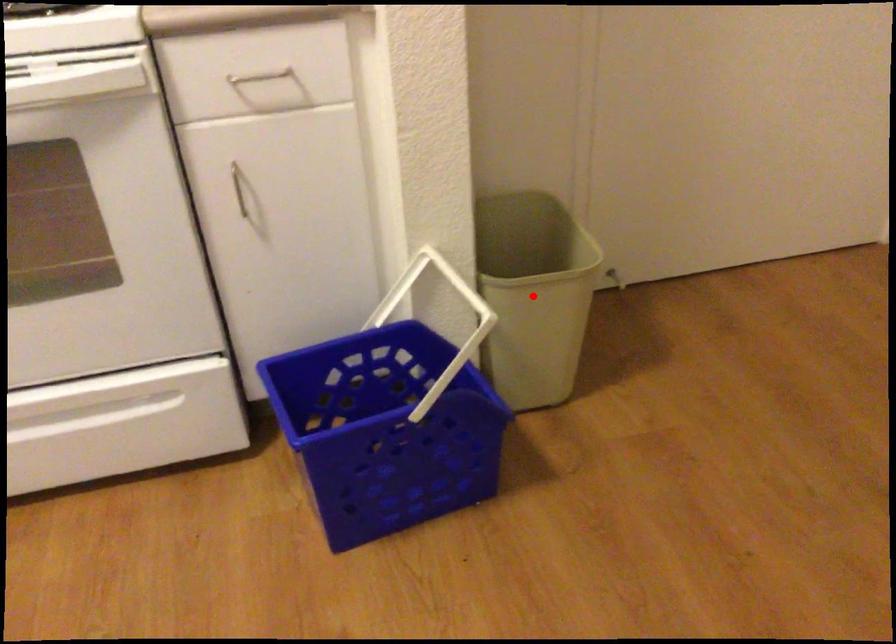
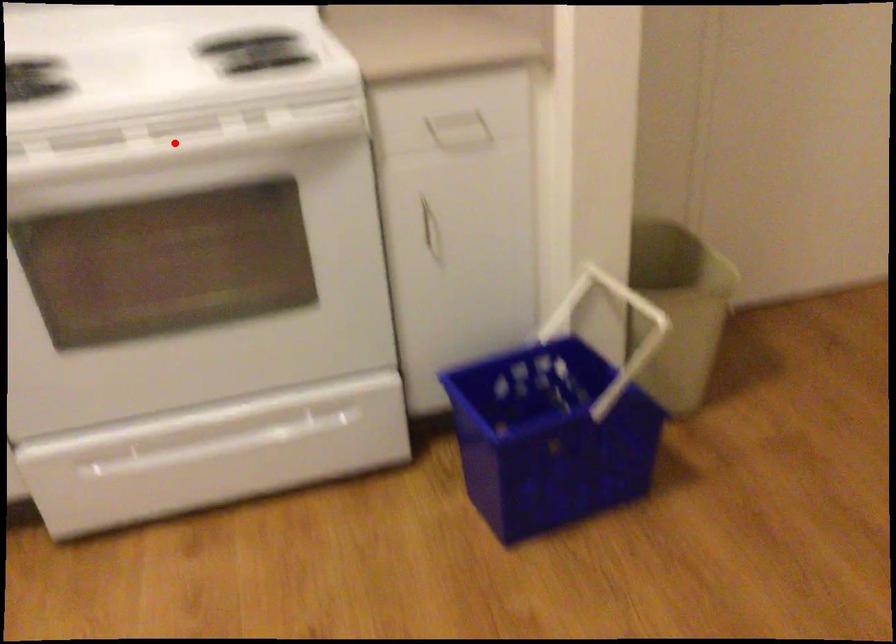
I am providing you with two images of the same scene from different viewpoints. A red point is marked on the first image and another point is marked on the second image. Is the red point in image1 aligned with the point shown in image2?

No